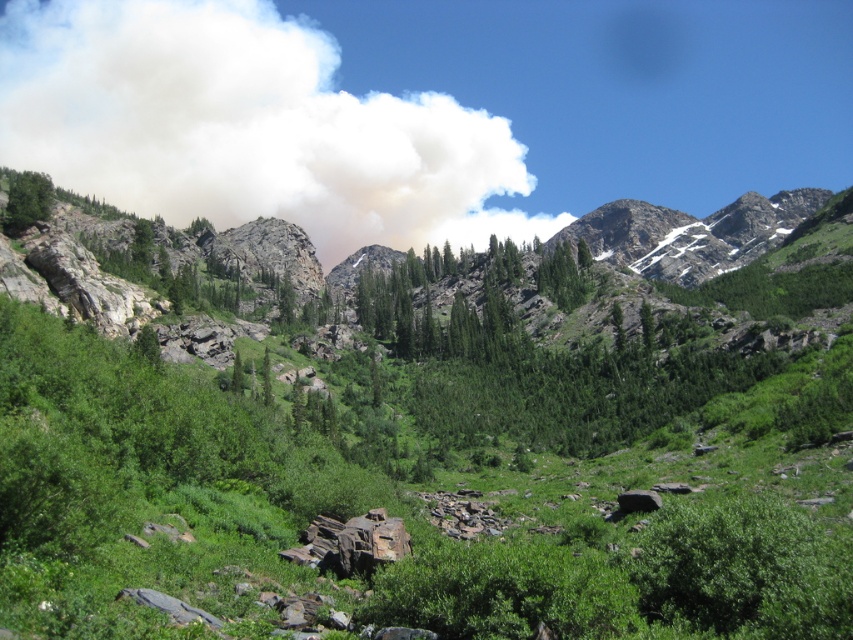
Question: Does white smoke at upper center have a greater width compared to green matte tree at upper left?

Choices:
 (A) yes
 (B) no

Answer: (A)

Question: Is white smoke at upper center to the right of green matte tree at upper left from the viewer's perspective?

Choices:
 (A) no
 (B) yes

Answer: (A)

Question: From the image, what is the correct spatial relationship of white smoke at upper center in relation to green matte tree at upper left?

Choices:
 (A) left
 (B) right

Answer: (A)

Question: Which point is closer to the camera?

Choices:
 (A) white smoke at upper center
 (B) green matte tree at upper left

Answer: (B)